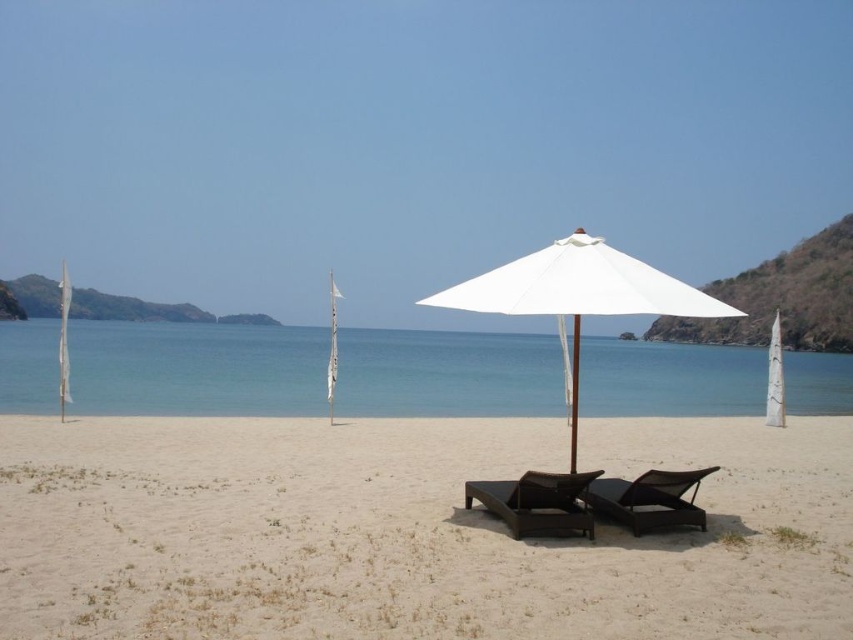
Question: Estimate the real-world distances between objects in this image. Which object is farther from the matte black daybed at center?

Choices:
 (A) dark brown woven lounge chair at center
 (B) black woven beach chair at center
 (C) white fabric pole at center
 (D) white sand at center

Answer: (D)

Question: Is matte black daybed at center thinner than dark brown woven lounge chair at center?

Choices:
 (A) no
 (B) yes

Answer: (A)

Question: Which object is the closest to the blue water at center?

Choices:
 (A) black woven beach chair at center
 (B) dark brown woven lounge chair at center
 (C) matte black daybed at center

Answer: (C)

Question: Which of the following is the farthest from the observer?

Choices:
 (A) (729, 486)
 (B) (556, 529)

Answer: (A)

Question: Considering the relative positions of matte black daybed at center and black woven beach chair at center in the image provided, where is matte black daybed at center located with respect to black woven beach chair at center?

Choices:
 (A) left
 (B) right

Answer: (B)

Question: Does black woven beach chair at center lie in front of white fabric pole at center?

Choices:
 (A) yes
 (B) no

Answer: (A)